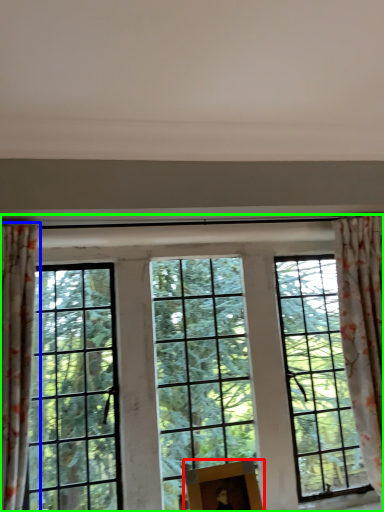
Question: Which is nearer to the picture frame (highlighted by a red box)? curtain (highlighted by a blue box) or window (highlighted by a green box).

Choices:
 (A) curtain
 (B) window

Answer: (B)